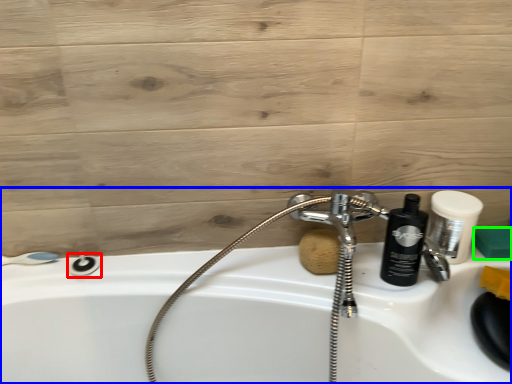
Question: Considering the real-world distances, which object is closest to shower (highlighted by a red box)? sink (highlighted by a blue box) or soap (highlighted by a green box).

Choices:
 (A) sink
 (B) soap

Answer: (A)